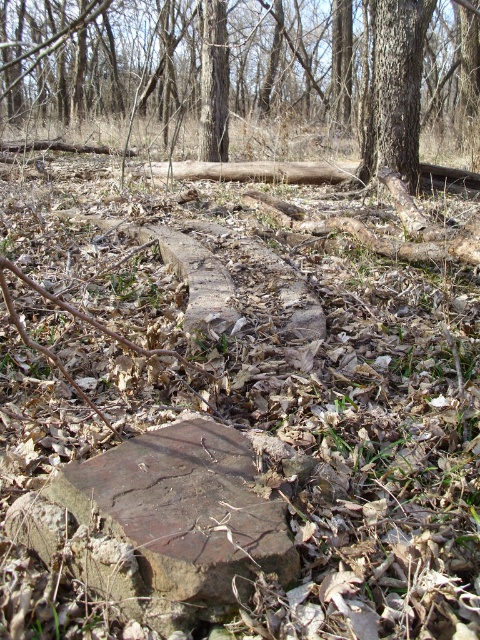
You are a hiker who has just found a smooth brown log at center and a brown rough stone at center in the forest. You need to place a 7.5 meter long rope between them. Can you fit the rope between the two objects without bending it?

The distance between the smooth brown log at center and the brown rough stone at center is 7.71 meters. Since the rope is 7.5 meters long, it is slightly shorter than the required distance. Therefore, the rope cannot be placed between them without bending it.